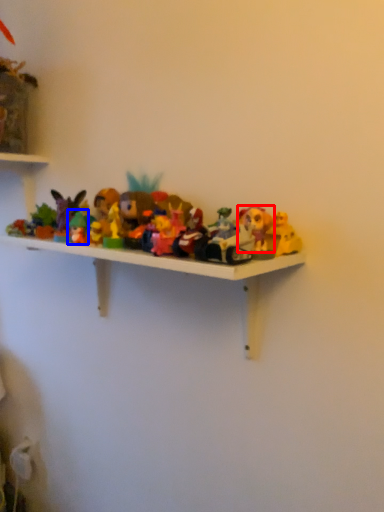
Question: Which object is closer to the camera taking this photo, toy (highlighted by a red box) or toy (highlighted by a blue box)?

Choices:
 (A) toy
 (B) toy

Answer: (A)